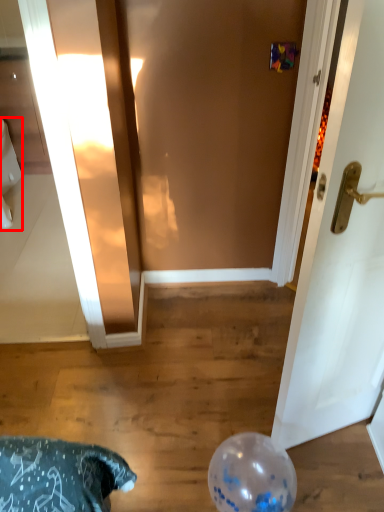
Question: From the image's perspective, what is the correct spatial positioning of toilet bowl (annotated by the red box) in reference to balloon?

Choices:
 (A) below
 (B) above

Answer: (B)